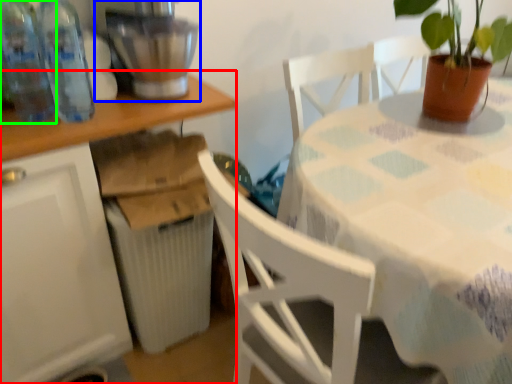
Question: Based on their relative distances, which object is nearer to table (highlighted by a red box)? Choose from mixer (highlighted by a blue box) and bottle (highlighted by a green box).

Choices:
 (A) mixer
 (B) bottle

Answer: (A)